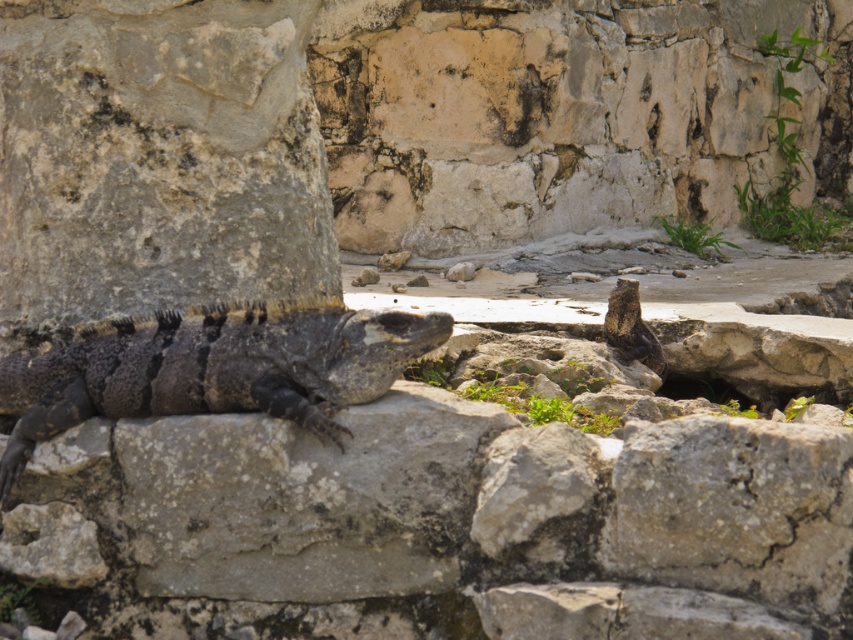
Based on the photo, you are a wildlife researcher observing two lizards in the image. You need to determine if they are close enough to interact. The minimum distance required for interaction between these species is 2 meters. Are the dark gray scaly lizard at center and the dark brown scaly lizard at center within the required distance?

The distance between the dark gray scaly lizard at center and the dark brown scaly lizard at center is 1.77 meters, which is less than the required 2 meters. Therefore, they are within the required distance to interact.

You are standing in front of the stone structure where the iguana is resting. You notice two points marked on the stones. The first point is at coordinates point (x=383, y=330) and the second is at point (x=627, y=342). If you were to reach out and touch one of them, which point would feel closer to your hand?

Point (x=383, y=330) is closer to the viewer than point (x=627, y=342), so touching that point would feel closer.

You are standing in front of a stone structure where the dark gray scaly lizard at center is resting. If you want to observe the lizard closely without disturbing it, what is the minimum safe distance you should maintain?

The minimum safe distance you should maintain is 3 meters, as the dark gray scaly lizard at center is currently 2.99 meters away from you. Since approaching closer than 3 meters might disturb it, staying at least 3 meters away ensures minimal disturbance.